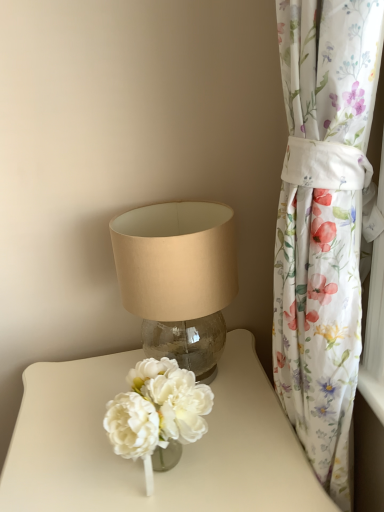
Find the location of a particular element. The image size is (384, 512). empty space that is ontop of translucent glass vase at center (from a real-world perspective) is located at coordinates (173, 453).